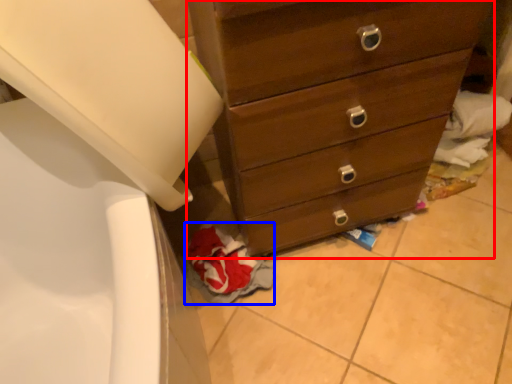
Question: Among these objects, which one is nearest to the camera, chest of drawers (highlighted by a red box) or material (highlighted by a blue box)?

Choices:
 (A) chest of drawers
 (B) material

Answer: (A)